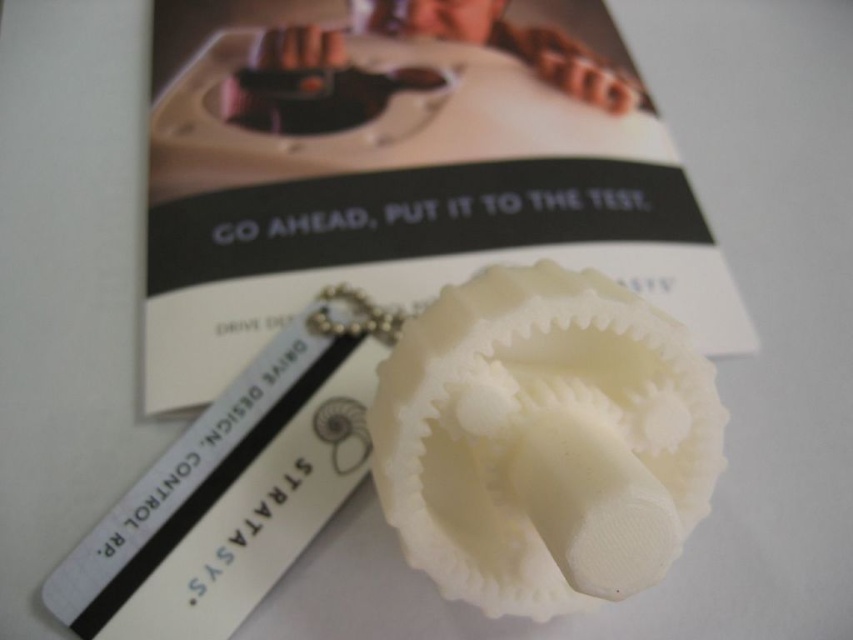
Does white matte gear at center appear under white plastic bookmark at center?

No.

Between white matte gear at center and white plastic bookmark at center, which one has more height?

Standing taller between the two is white matte gear at center.

Find the location of `white matte gear at center`. white matte gear at center is located at coordinates (402, 170).